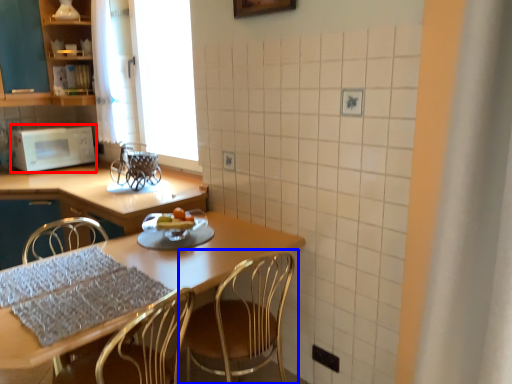
Question: Which point is further to the camera, microwave oven (highlighted by a red box) or chair (highlighted by a blue box)?

Choices:
 (A) microwave oven
 (B) chair

Answer: (A)